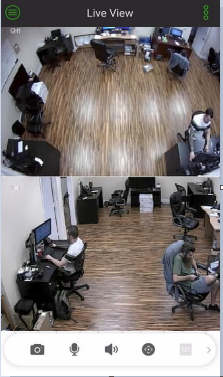
Find the location of a particular element. desk is located at coordinates (91, 211).